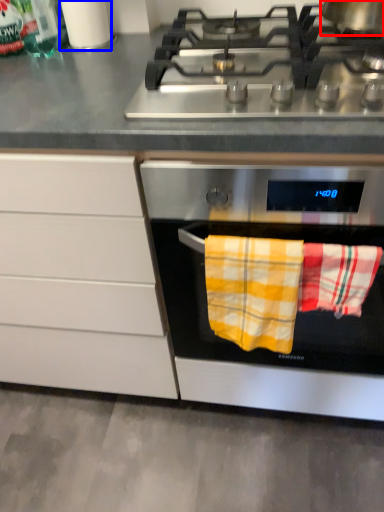
Question: Which of the following is the farthest to the observer, kitchen appliance (highlighted by a red box) or appliance (highlighted by a blue box)?

Choices:
 (A) kitchen appliance
 (B) appliance

Answer: (B)